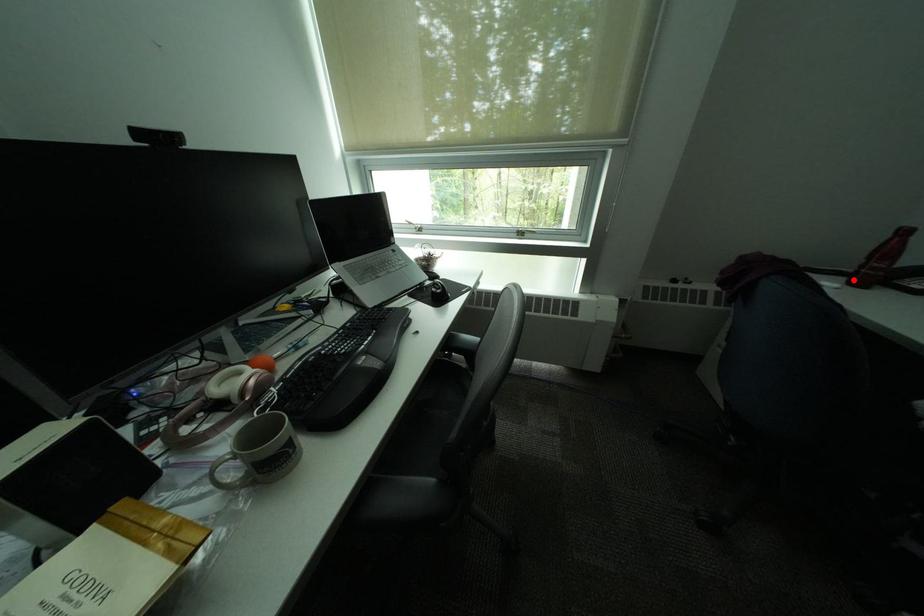
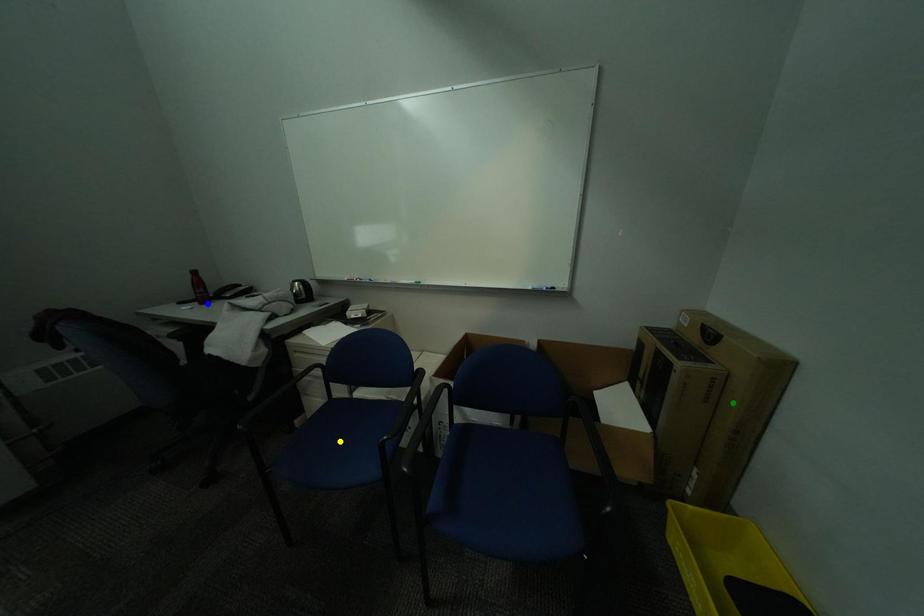
Question: I am providing you with two images of the same scene from different viewpoints. A red point is marked on the first image. You are given multiple points on the second image. Which point in image 2 is actually the same real-world point as the red point in image 1?

Choices:
 (A) blue point
 (B) yellow point
 (C) green point

Answer: (A)